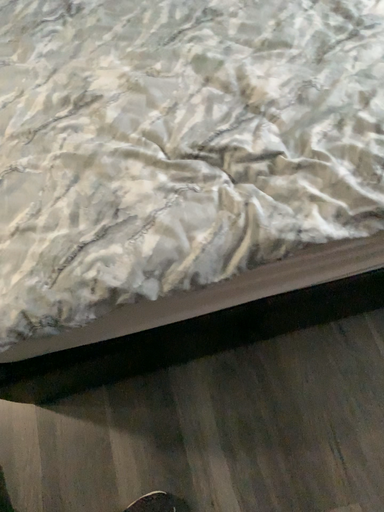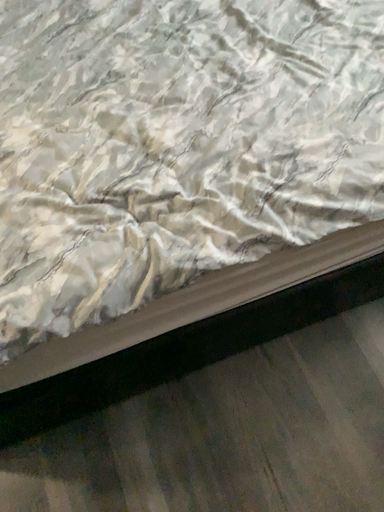
Question: Which way did the camera rotate in the video?

Choices:
 (A) rotated downward
 (B) rotated upward

Answer: (B)